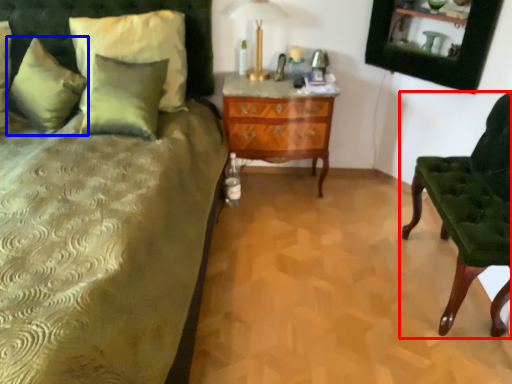
Question: Among these objects, which one is farthest to the camera, chair (highlighted by a red box) or pillow (highlighted by a blue box)?

Choices:
 (A) chair
 (B) pillow

Answer: (B)